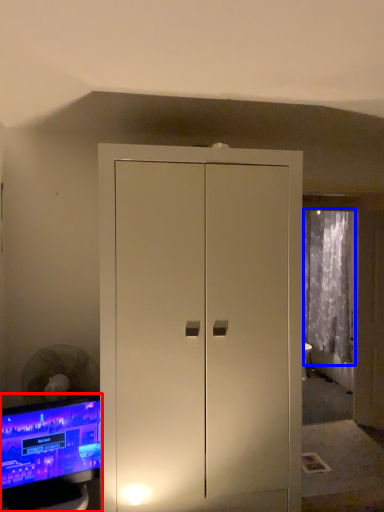
Question: Among these objects, which one is farthest to the camera, computer monitor (highlighted by a red box) or curtain (highlighted by a blue box)?

Choices:
 (A) computer monitor
 (B) curtain

Answer: (B)